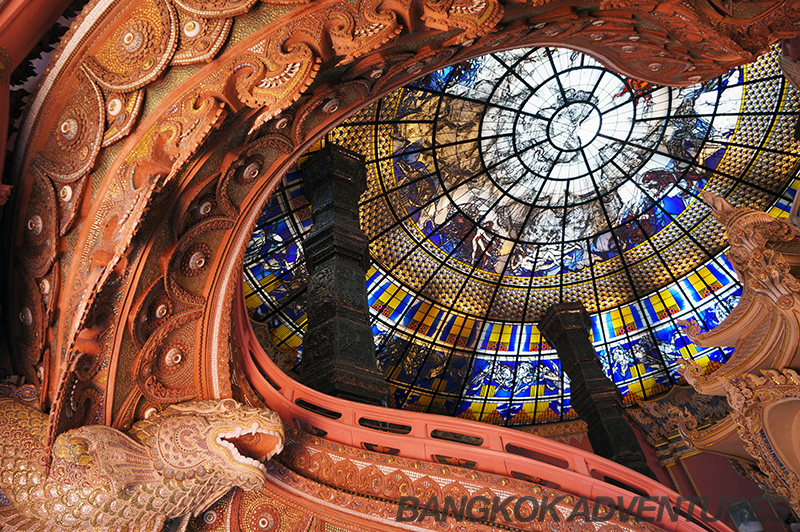
The image size is (800, 532). I want to click on white stained glass, so click(x=686, y=293).